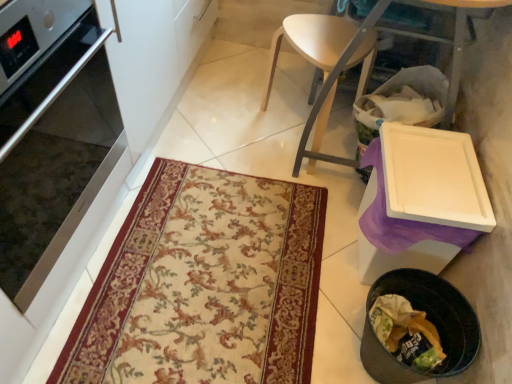
Question: Is beige floral rug at center smaller than light wood chair at center?

Choices:
 (A) yes
 (B) no

Answer: (A)

Question: Does beige floral rug at center have a lesser height compared to light wood chair at center?

Choices:
 (A) yes
 (B) no

Answer: (A)

Question: Is beige floral rug at center taller than light wood chair at center?

Choices:
 (A) no
 (B) yes

Answer: (A)

Question: Is beige floral rug at center oriented towards light wood chair at center?

Choices:
 (A) yes
 (B) no

Answer: (B)

Question: Can you confirm if beige floral rug at center is thinner than light wood chair at center?

Choices:
 (A) yes
 (B) no

Answer: (B)

Question: Is beige floral rug at center positioned with its back to light wood chair at center?

Choices:
 (A) no
 (B) yes

Answer: (B)

Question: Can you confirm if black plastic trash can at lower right is positioned to the left of satin silver oven at left?

Choices:
 (A) no
 (B) yes

Answer: (A)

Question: Does black plastic trash can at lower right have a greater width compared to satin silver oven at left?

Choices:
 (A) yes
 (B) no

Answer: (B)

Question: Considering the relative sizes of black plastic trash can at lower right and satin silver oven at left in the image provided, is black plastic trash can at lower right bigger than satin silver oven at left?

Choices:
 (A) yes
 (B) no

Answer: (B)

Question: Would you say black plastic trash can at lower right is a long distance from satin silver oven at left?

Choices:
 (A) no
 (B) yes

Answer: (A)

Question: From a real-world perspective, is black plastic trash can at lower right positioned over satin silver oven at left based on gravity?

Choices:
 (A) no
 (B) yes

Answer: (A)

Question: Is black plastic trash can at lower right to the right of satin silver oven at left from the viewer's perspective?

Choices:
 (A) no
 (B) yes

Answer: (B)

Question: Can you confirm if satin silver oven at left is bigger than beige floral rug at center?

Choices:
 (A) no
 (B) yes

Answer: (B)